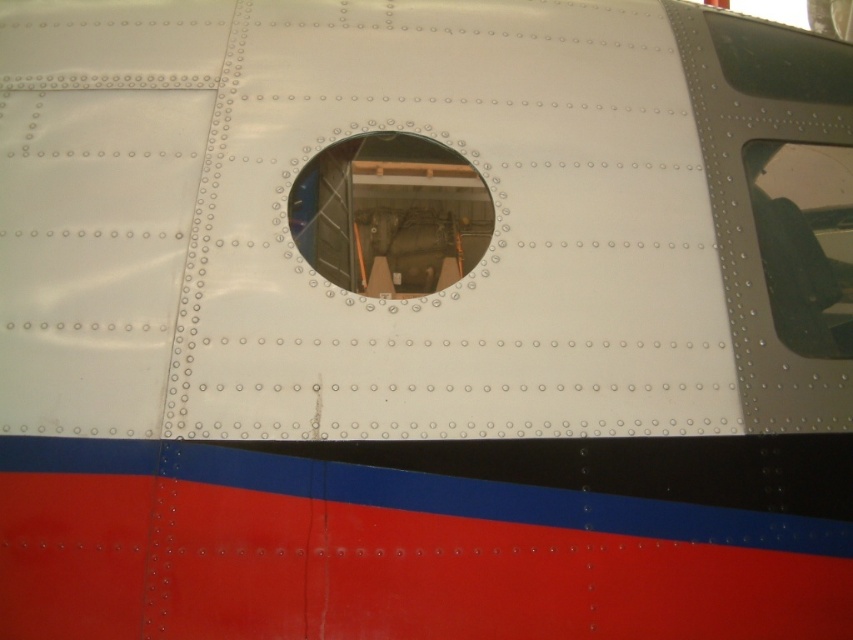
You are an aircraft inspector checking the side panel of an aircraft. You notice the glossy metal porthole at center. Where exactly is it located on the panel?

The glossy metal porthole at center is located at point coordinates of (x=390, y=214) on the panel.

You are an aircraft inspector checking the side panel of an aircraft. You notice a point labeled as point (390, 214). Based on the scene, what object is located at this point?

The point (390, 214) indicates the glossy metal porthole at center.